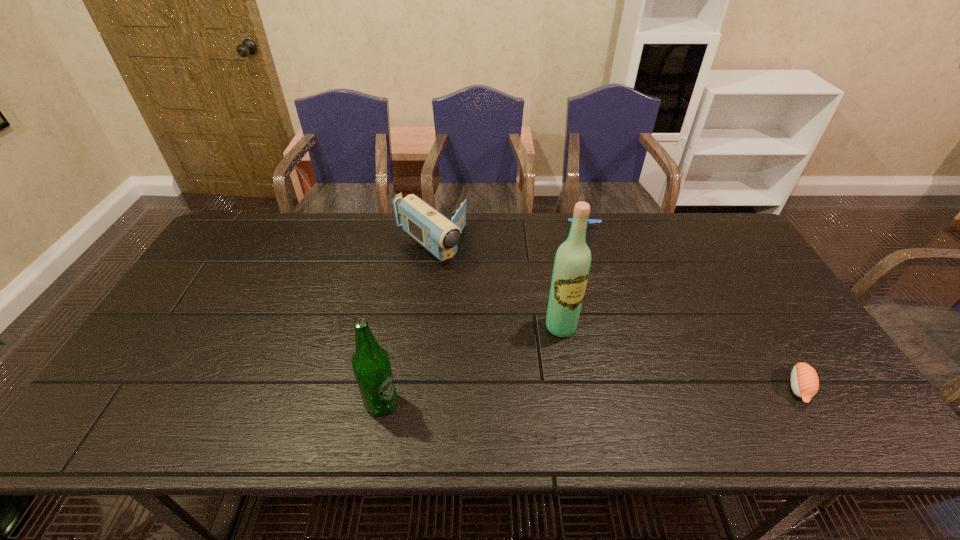
You are a GUI agent. You are given a task and a screenshot of the screen. Output one action in this format:
    pyautogui.click(x=<x>, y=<y>)
    Task: Click on the beer bottle at the near edge
    The width and height of the screenshot is (960, 540).
    Given the screenshot: What is the action you would take?
    pyautogui.click(x=371, y=366)

At what (x,y) coordinates should I click in order to perform the action: click on sushi positioned at the near edge. Please return your answer as a coordinate pair (x, y). Image resolution: width=960 pixels, height=540 pixels. Looking at the image, I should click on (804, 380).

This screenshot has width=960, height=540. I want to click on object at the right edge, so click(804, 380).

You are a GUI agent. You are given a task and a screenshot of the screen. Output one action in this format:
    pyautogui.click(x=<x>, y=<y>)
    Task: Click on the object at the near right corner
    The height and width of the screenshot is (540, 960).
    Given the screenshot: What is the action you would take?
    pyautogui.click(x=804, y=380)

Where is `vacant space at the far edge of the desktop`? The height and width of the screenshot is (540, 960). vacant space at the far edge of the desktop is located at coordinates (396, 238).

In the image, there is a desktop. Identify the location of free space at the near edge. The image size is (960, 540). (471, 403).

Identify the location of free space at the left edge of the desktop. This screenshot has width=960, height=540. (194, 359).

I want to click on vacant space at the far left corner of the desktop, so click(x=265, y=221).

Find the location of a particular element. This screenshot has width=960, height=540. empty space between the tallest object and the beer bottle is located at coordinates (471, 365).

Locate an element on the screen. The height and width of the screenshot is (540, 960). vacant area between the wine bottle and the third shortest object is located at coordinates (495, 286).